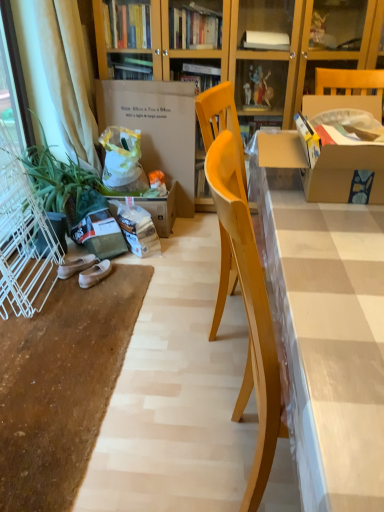
Question: Is matte cardboard desk at center inside the boundaries of beige fabric curtain at left, or outside?

Choices:
 (A) inside
 (B) outside

Answer: (B)

Question: In terms of size, does matte cardboard desk at center appear bigger or smaller than beige fabric curtain at left?

Choices:
 (A) big
 (B) small

Answer: (A)

Question: Based on their relative distances, which object is farther from the matte cardboard desk at center?

Choices:
 (A) white wire screen door at left
 (B) white cardboard box at center
 (C) green matte plant at left
 (D) white suede shoes at lower left, which is counted as the 2th footwear, starting from the left
 (E) beige suede shoes at lower left, acting as the first footwear starting from the left

Answer: (B)

Question: Estimate the real-world distances between objects in this image. Which object is farther from the beige suede shoes at lower left, which is the second footwear from right to left?

Choices:
 (A) green matte plant at left
 (B) beige fabric curtain at left
 (C) white wire screen door at left
 (D) white cardboard box at center
 (E) white suede shoes at lower left, the 1th footwear positioned from the right

Answer: (B)